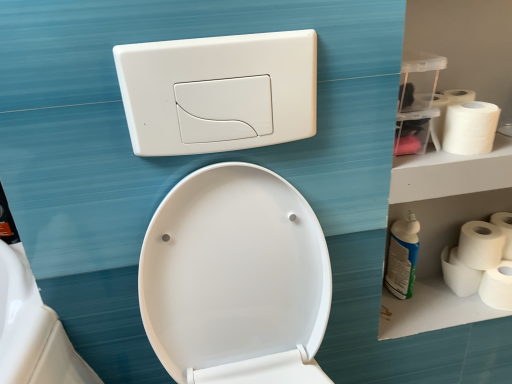
Question: Considering the positions of white matte toilet paper at right, which ranks as the fifth toilet paper in top-to-bottom order, and blue glossy spray bottle at right in the image, is white matte toilet paper at right, which ranks as the fifth toilet paper in top-to-bottom order, bigger or smaller than blue glossy spray bottle at right?

Choices:
 (A) big
 (B) small

Answer: (B)

Question: Based on their positions, is white matte toilet paper at right, the first toilet paper in the bottom-to-top sequence, located to the left or right of blue glossy spray bottle at right?

Choices:
 (A) right
 (B) left

Answer: (A)

Question: Which is nearer to the white matte toilet paper at right, the 2th toilet paper viewed from the top?

Choices:
 (A) white matte toilet paper at right, which appears as the third toilet paper when viewed from the top
 (B) white plastic flush plate at upper center
 (C) white matte toilet paper at right, arranged as the 4th toilet paper when viewed from the top
 (D) blue glossy spray bottle at right
 (E) white matte toilet paper at right, which ranks as the fifth toilet paper in top-to-bottom order

Answer: (A)

Question: Considering the real-world distances, which object is farthest from the white matte toilet paper at right, arranged as the 4th toilet paper when viewed from the top?

Choices:
 (A) white matte toilet paper at right, which appears as the third toilet paper when viewed from the top
 (B) white matte toilet paper at right, positioned as the fifth toilet paper in bottom-to-top order
 (C) white matte toilet paper at right, which is counted as the 4th toilet paper, starting from the bottom
 (D) white plastic flush plate at upper center
 (E) blue glossy spray bottle at right

Answer: (D)